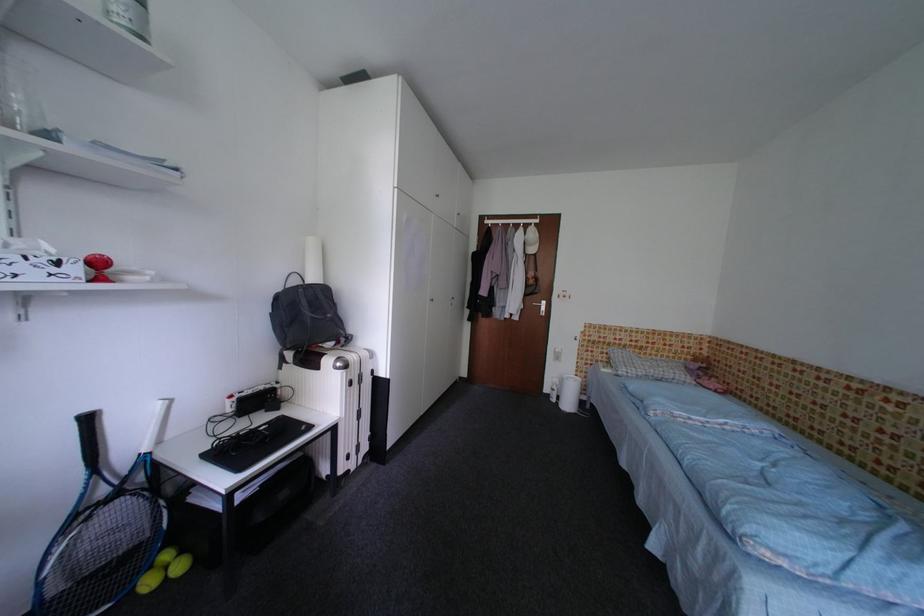
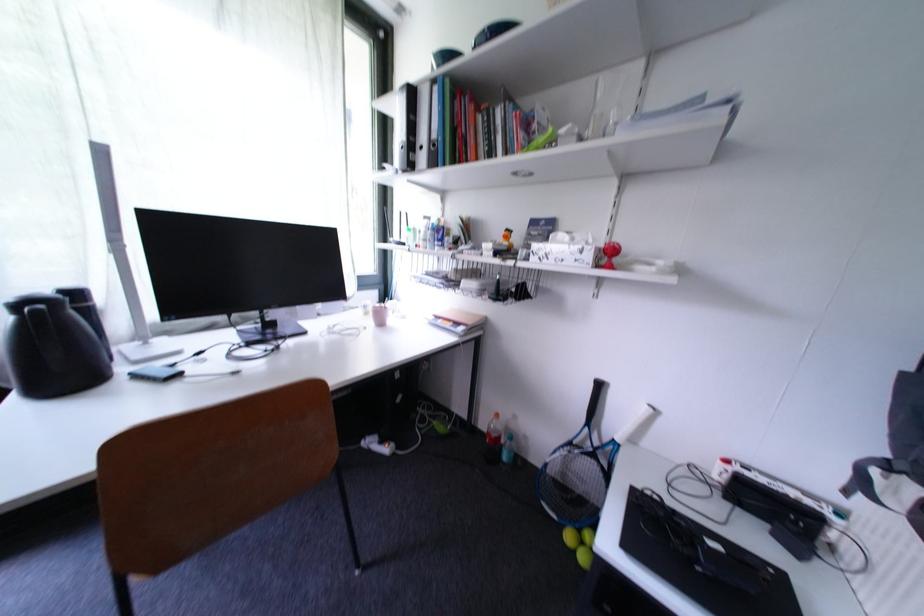
Question: I am providing you with two images of the same scene from different viewpoints. Please identify which objects are invisible in image2.

Choices:
 (A) green ring binder
 (B) white tissue box
 (C) drinking glass
 (D) none of these

Answer: (D)